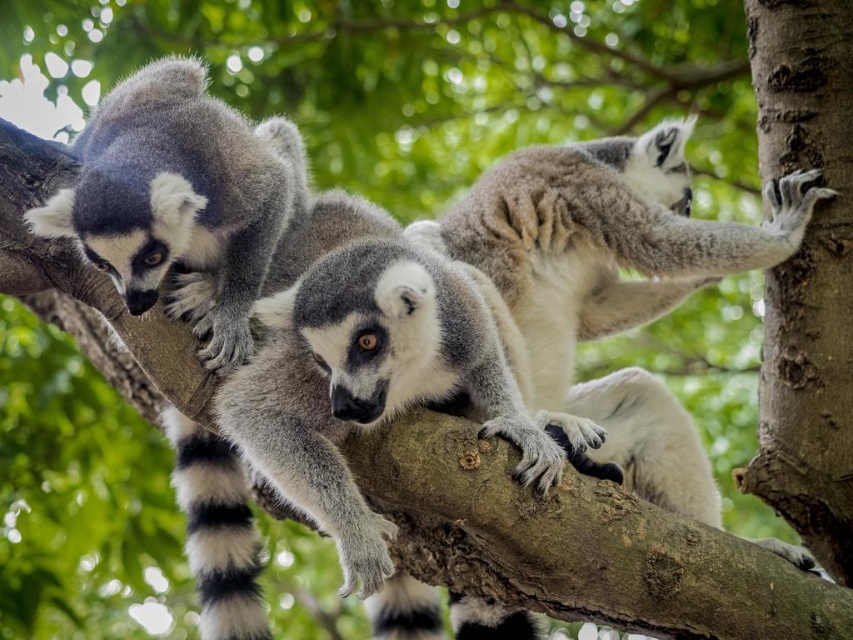
Can you confirm if ring-tailed lemur at left is bigger than black and white striped tail at center?

Yes, ring-tailed lemur at left is bigger than black and white striped tail at center.

Find the location of a particular element. ring-tailed lemur at left is located at coordinates (180, 200).